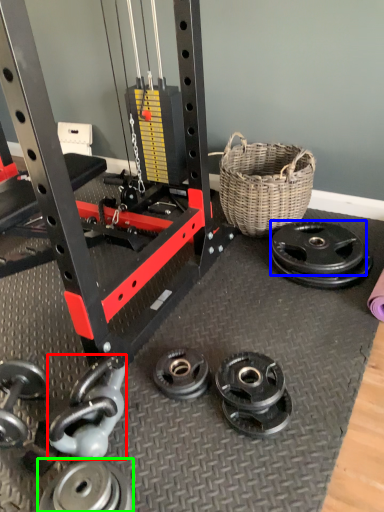
Question: Estimate the real-world distances between objects in this image. Which object is farther from dumbbell (highlighted by a red box), wheel (highlighted by a blue box) or wheel (highlighted by a green box)?

Choices:
 (A) wheel
 (B) wheel

Answer: (A)